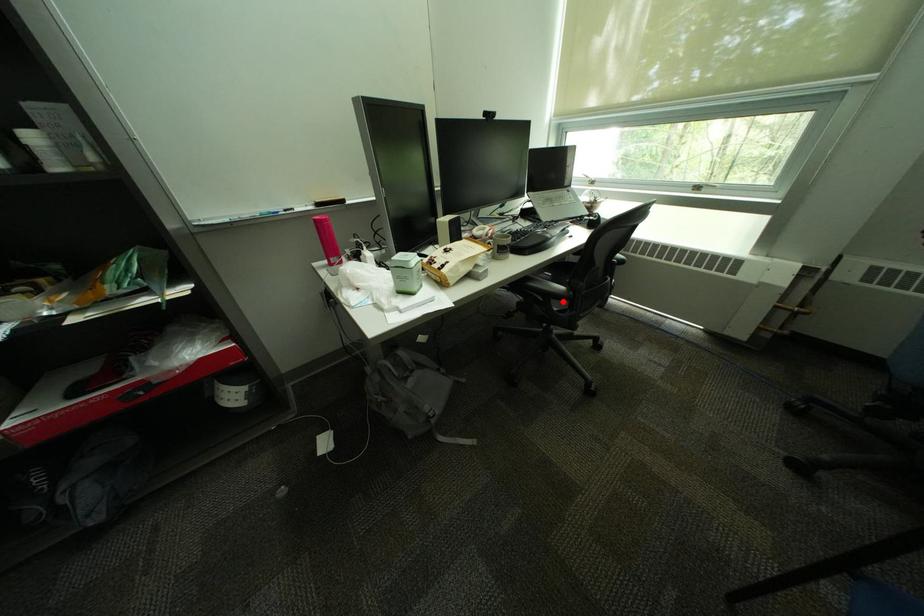
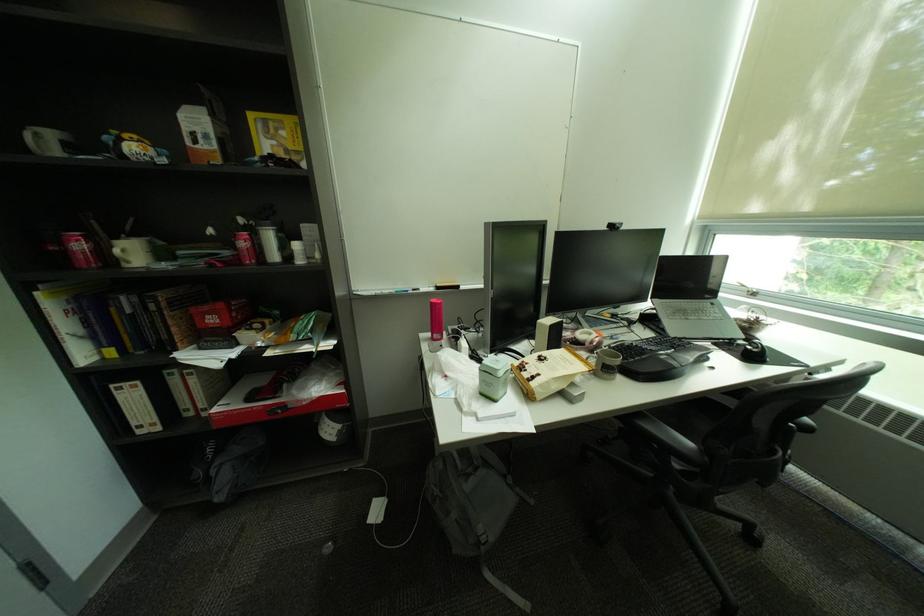
In the second image, find the point that corresponds to the highlighted location in the first image.

(684, 458)